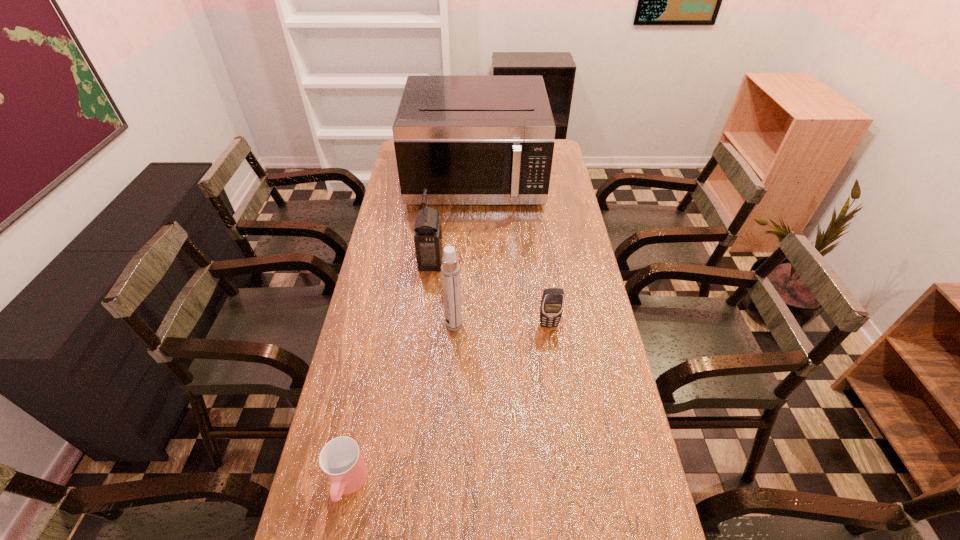
What are the coordinates of `microwave_oven` in the screenshot? It's located at [x=469, y=140].

Image resolution: width=960 pixels, height=540 pixels. What are the coordinates of `aerosol can` in the screenshot? It's located at (450, 269).

You are a GUI agent. You are given a task and a screenshot of the screen. Output one action in this format:
    pyautogui.click(x=<x>, y=<y>)
    Task: Click on the fourth nearest object
    
    Given the screenshot: What is the action you would take?
    pyautogui.click(x=428, y=234)

The image size is (960, 540). What are the coordinates of `cellular telephone` in the screenshot? It's located at (552, 302).

The width and height of the screenshot is (960, 540). Find the location of `cup`. cup is located at coordinates (341, 460).

Locate an element on the screen. This screenshot has width=960, height=540. the shortest object is located at coordinates (341, 460).

Identify the location of vacant space situated 0.120m on the front-facing side of the farthest object. (474, 236).

This screenshot has height=540, width=960. I want to click on free region located on the left of the aerosol can, so click(416, 325).

What are the coordinates of `vacant space located on the front-facing side of the lantern` in the screenshot? It's located at (557, 261).

You are a GUI agent. You are given a task and a screenshot of the screen. Output one action in this format:
    pyautogui.click(x=<x>, y=<y>)
    Task: Click on the free region located 0.130m on the front face of the fourth tallest object
    This screenshot has height=540, width=960.
    Given the screenshot: What is the action you would take?
    pyautogui.click(x=555, y=366)